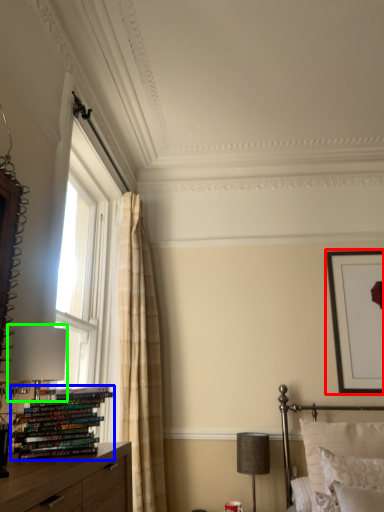
Question: Estimate the real-world distances between objects in this image. Which object is farther from picture frame (highlighted by a red box), book (highlighted by a blue box) or table lamp (highlighted by a green box)?

Choices:
 (A) book
 (B) table lamp

Answer: (A)